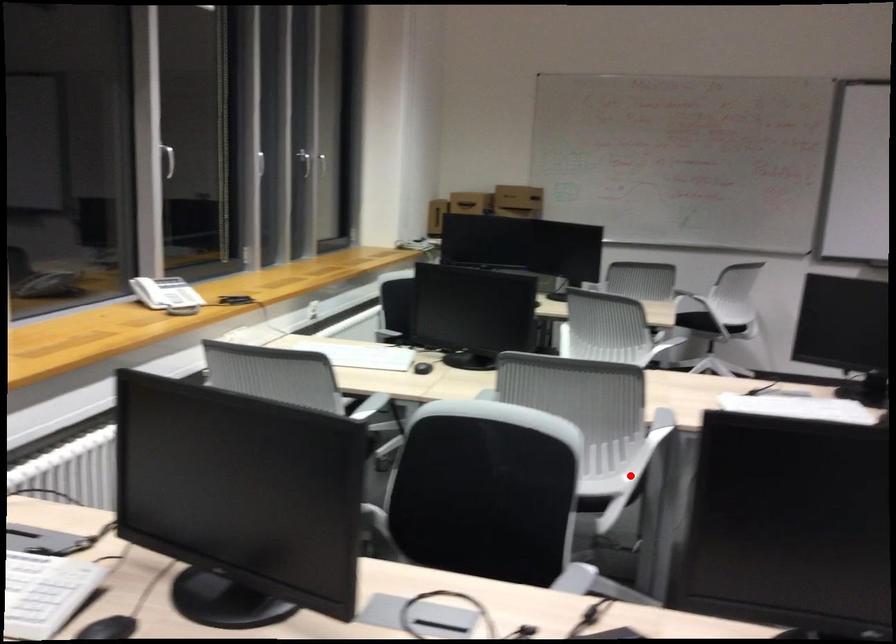
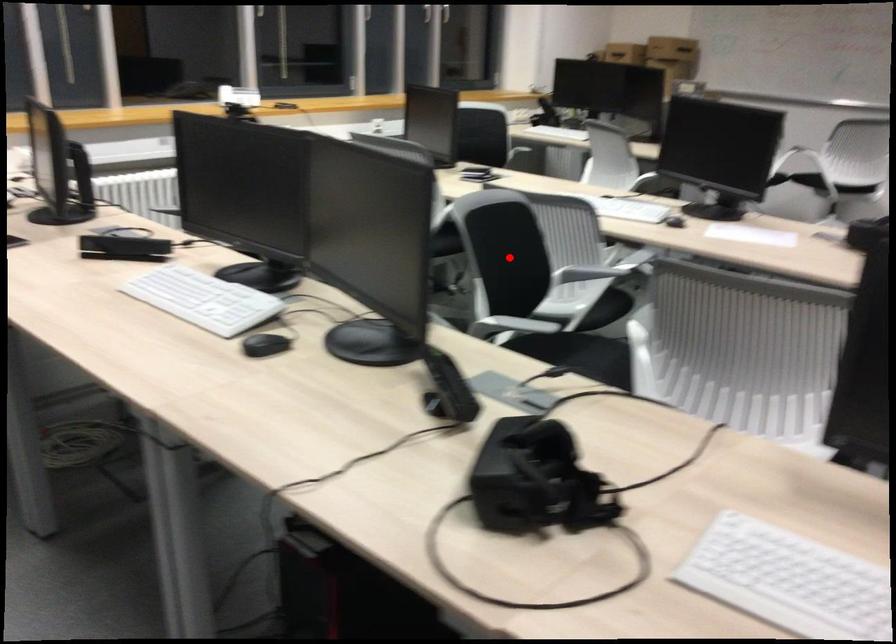
I am providing you with two images of the same scene from different viewpoints. A red point is marked on the first image and another point is marked on the second image. Do the highlighted points in image1 and image2 indicate the same real-world spot?

No